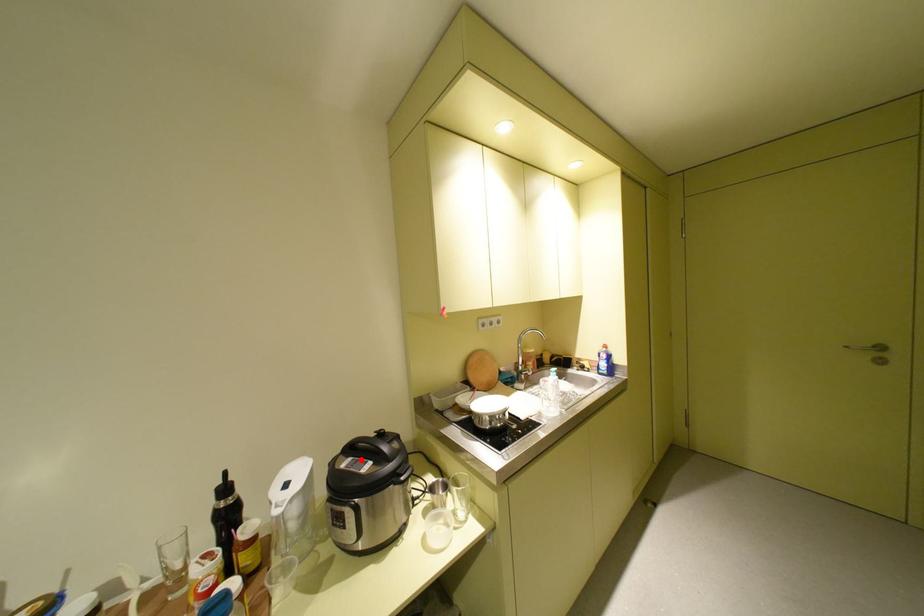
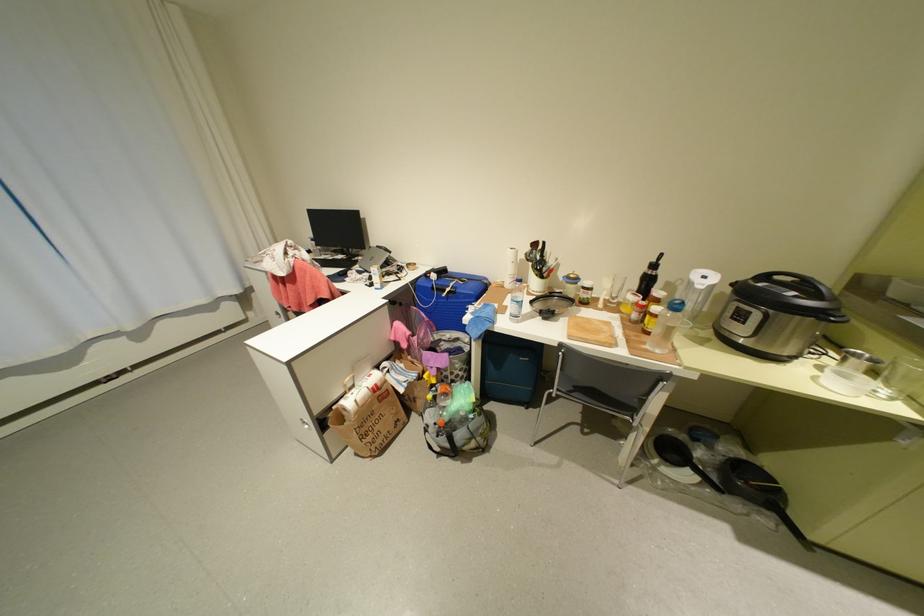
The point at the highlighted location is marked in the first image. Where is the corresponding point in the second image?

(777, 284)